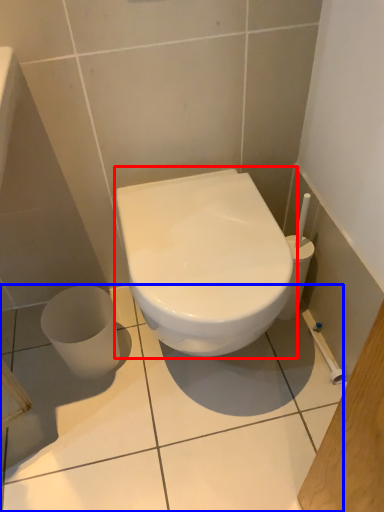
Question: Which object is closer to the camera taking this photo, toilet (highlighted by a red box) or ceramic tile (highlighted by a blue box)?

Choices:
 (A) toilet
 (B) ceramic tile

Answer: (A)